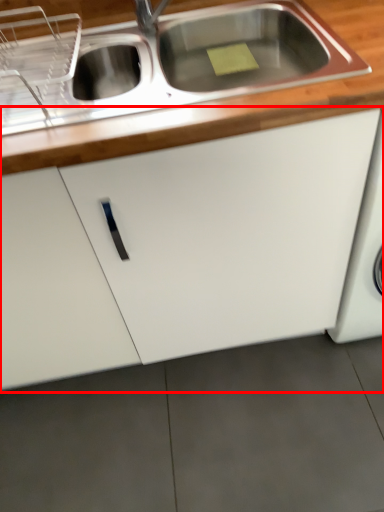
Question: From the image's perspective, where is cabinetry (annotated by the red box) located relative to countertop?

Choices:
 (A) above
 (B) below

Answer: (B)